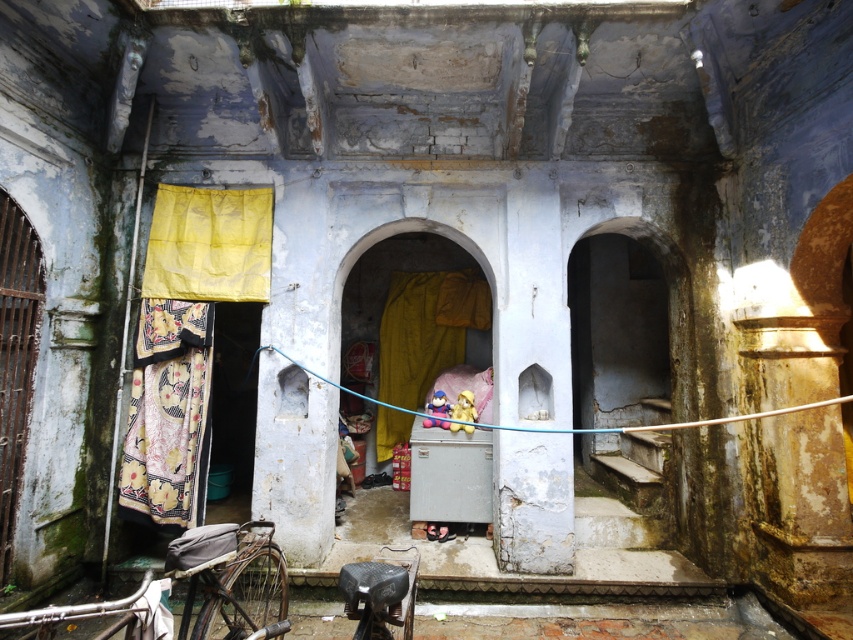
You are standing in the old interior space and want to hang a new piece of fabric. The printed fabric laundry at left is closer to you than the yellow fabric at center. Which fabric should you move if you want to hang the new one between them?

You should move the printed fabric laundry at left because it is closer to the viewer, so moving it would allow space between it and the yellow fabric at center for the new fabric.

You are a visitor in this old building and want to hang your new laundry. The printed fabric laundry at left and the metallic silver bicycle at lower left are already present. Which object takes up more space in the scene?

The metallic silver bicycle at lower left takes up more space than the printed fabric laundry at left.